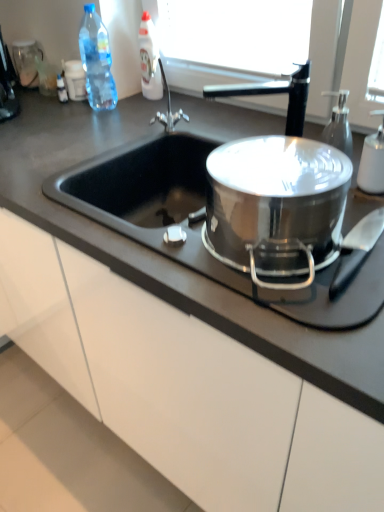
At what (x,y) coordinates should I click in order to perform the action: click on vacant area that lies between transparent plastic bottle at upper left, the second bottle viewed from the front, and white glossy bottle at upper center, the 1th bottle from the top. Please return your answer as a coordinate pair (x, y). The image size is (384, 512). Looking at the image, I should click on (131, 103).